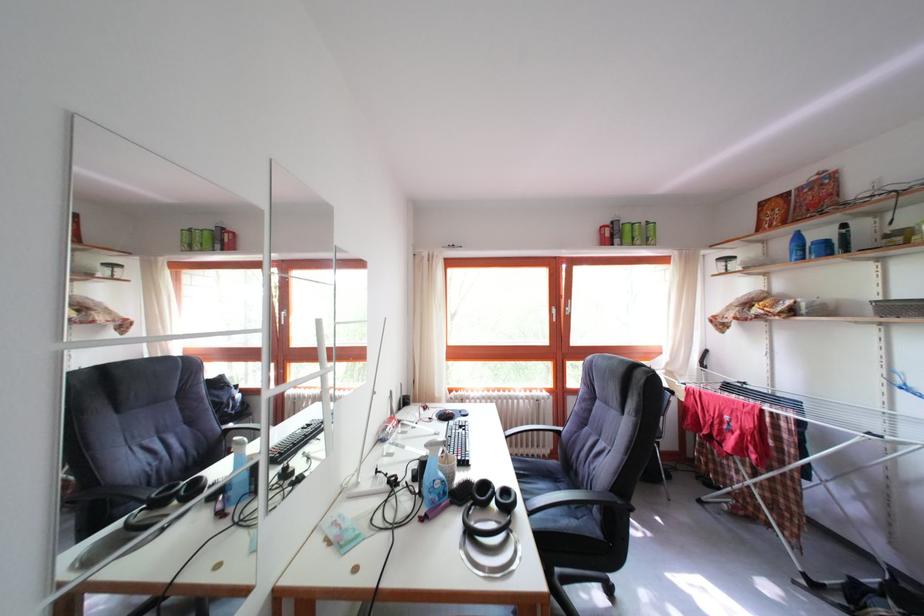
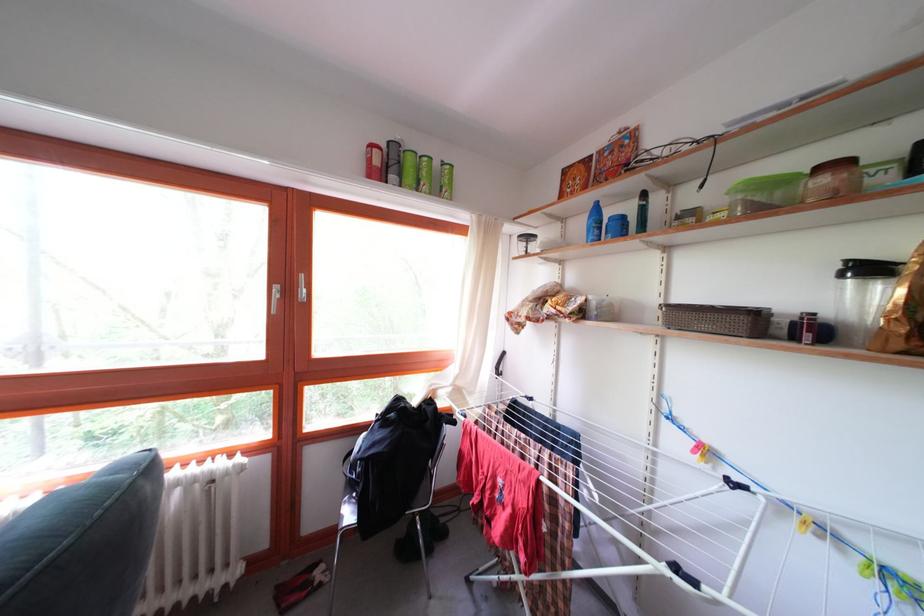
The point at [629,245] is marked in the first image. Where is the corresponding point in the second image?

(409, 180)